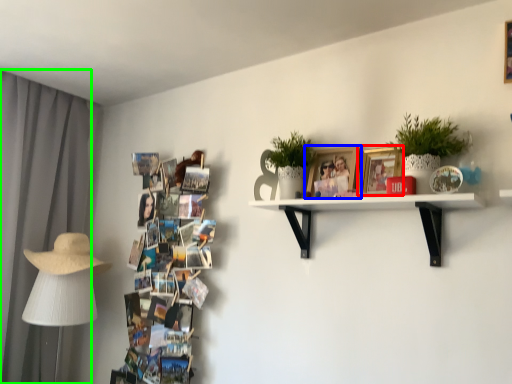
Question: Considering the real-world distances, which object is farthest from picture frame (highlighted by a red box)? picture frame (highlighted by a blue box) or curtain (highlighted by a green box)?

Choices:
 (A) picture frame
 (B) curtain

Answer: (B)